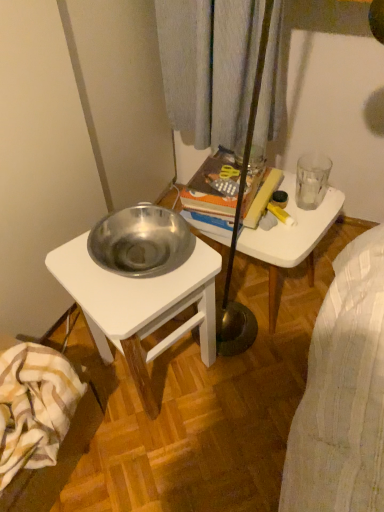
This screenshot has width=384, height=512. Find the location of `blank space situated above orange hardcover book at center (from a real-world perspective)`. blank space situated above orange hardcover book at center (from a real-world perspective) is located at coordinates (226, 181).